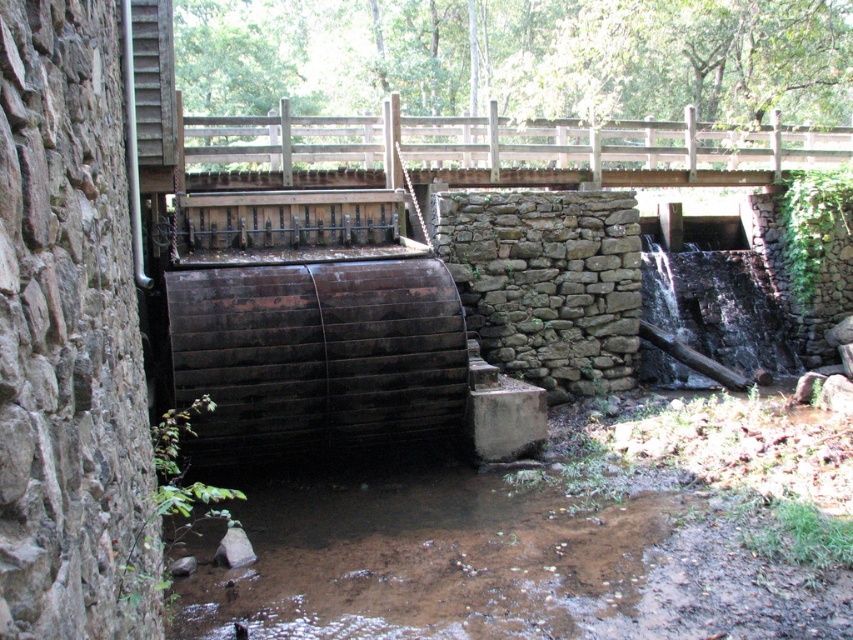
Does brown muddy water at lower center come behind wooden bridge at upper center?

That is False.

Who is positioned more to the right, brown muddy water at lower center or wooden bridge at upper center?

wooden bridge at upper center is more to the right.

Which is behind, point (312, 532) or point (212, 131)?

Positioned behind is point (212, 131).

You are a GUI agent. You are given a task and a screenshot of the screen. Output one action in this format:
    pyautogui.click(x=<x>, y=<y>)
    Task: Click on the brown muddy water at lower center
    
    Given the screenshot: What is the action you would take?
    pyautogui.click(x=427, y=557)